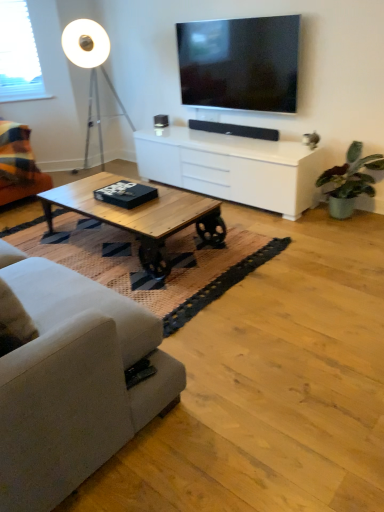
The height and width of the screenshot is (512, 384). In order to click on unoccupied region to the right of light gray fabric couch at left, placed as the first studio couch when sorted from front to back in this screenshot , I will do `click(274, 353)`.